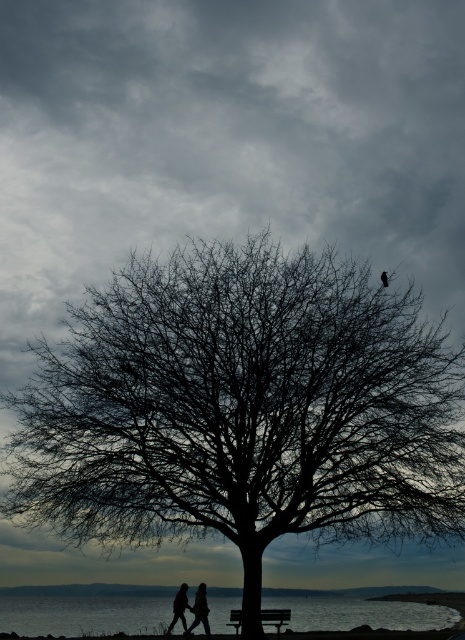
You are an artist planning to paint the scene. You want to ensure the wooden bench at center is proportionally smaller than the silvery water at lower center. Does the current arrangement allow this?

Yes, the silvery water at lower center is larger in size than the wooden bench at center, so the current arrangement allows the wooden bench at center to be proportionally smaller.

You are a painter standing at the edge of the scene. You want to paint the black bare tree at center and the wooden bench at center. Which object should you focus on first if you want to paint the taller one first?

The black bare tree at center is much taller than the wooden bench at center, so you should focus on painting the black bare tree at center first.